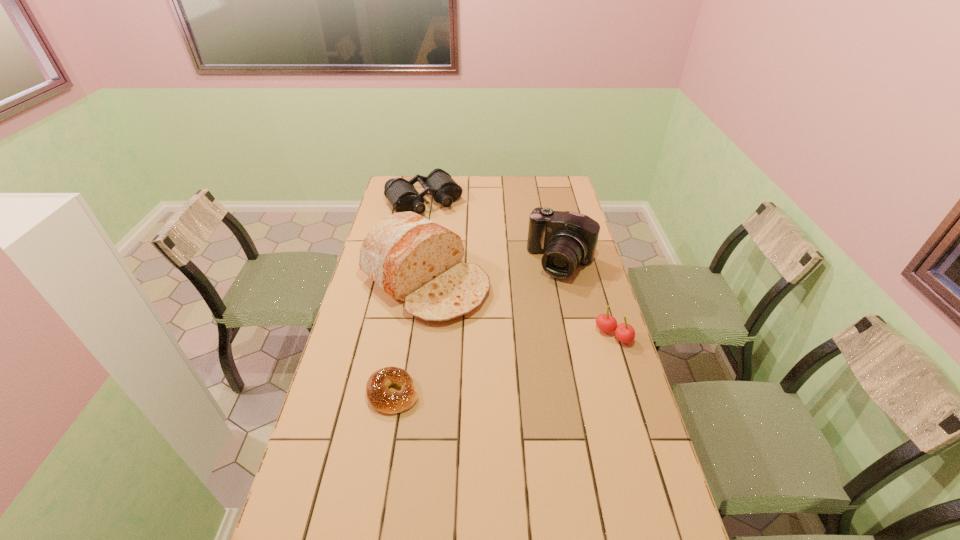
Locate an element on the screen. blank space located 0.230m at the sliced end of the tallest object is located at coordinates (521, 347).

You are a GUI agent. You are given a task and a screenshot of the screen. Output one action in this format:
    pyautogui.click(x=<x>, y=<y>)
    Task: Click on the free location located on the lens of the camera
    This screenshot has height=540, width=960.
    Given the screenshot: What is the action you would take?
    pyautogui.click(x=541, y=298)

Image resolution: width=960 pixels, height=540 pixels. I want to click on free spot located 0.060m on the lens of the camera, so click(x=544, y=293).

You are a GUI agent. You are given a task and a screenshot of the screen. Output one action in this format:
    pyautogui.click(x=<x>, y=<y>)
    Task: Click on the vacant space located on the lens of the camera
    
    Given the screenshot: What is the action you would take?
    pyautogui.click(x=528, y=321)

At what (x,y) coordinates should I click in order to perform the action: click on vacant space located through the eyepieces of the binoculars. Please return your answer as a coordinate pair (x, y). Looking at the image, I should click on (450, 233).

At what (x,y) coordinates should I click in order to perform the action: click on free spot located 0.230m through the eyepieces of the binoculars. Please return your answer as a coordinate pair (x, y). This screenshot has width=960, height=540. Looking at the image, I should click on (460, 245).

The height and width of the screenshot is (540, 960). I want to click on free space located through the eyepieces of the binoculars, so click(x=456, y=240).

The height and width of the screenshot is (540, 960). Find the location of `object that is at the far edge`. object that is at the far edge is located at coordinates (402, 195).

This screenshot has width=960, height=540. I want to click on bagel at the left edge, so click(381, 399).

I want to click on bread that is at the left edge, so click(414, 260).